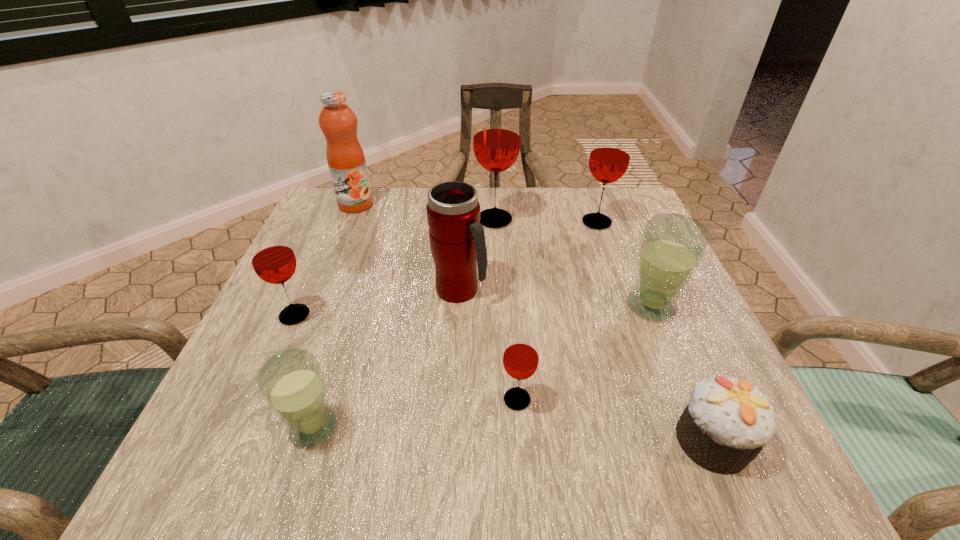
At what (x,y) coordinates should I click in order to perform the action: click on object that is at the near right corner. Please return your answer as a coordinate pair (x, y). The height and width of the screenshot is (540, 960). Looking at the image, I should click on (727, 422).

This screenshot has height=540, width=960. Find the location of `vacant region at the far edge of the desktop`. vacant region at the far edge of the desktop is located at coordinates (524, 212).

Where is `vacant space at the near edge of the desktop`? vacant space at the near edge of the desktop is located at coordinates (345, 436).

Identify the location of free location at the left edge of the desktop. (319, 294).

Identify the location of vacant space at the right edge. The height and width of the screenshot is (540, 960). (596, 260).

In the image, there is a desktop. Where is `vacant space at the far right corner`? This screenshot has width=960, height=540. vacant space at the far right corner is located at coordinates (584, 198).

Find the location of a particular element. The height and width of the screenshot is (540, 960). free space between the leftmost red glass and the smallest red glass is located at coordinates pyautogui.click(x=406, y=357).

Locate an element on the screen. empty space that is in between the tallest glass and the smallest red glass is located at coordinates (506, 309).

You are a GUI agent. You are given a task and a screenshot of the screen. Output one action in this format:
    pyautogui.click(x=<x>, y=<y>)
    Task: Click on the empty space that is in between the smallest red glass and the fifth glass from right to left
    Image resolution: width=960 pixels, height=540 pixels.
    Given the screenshot: What is the action you would take?
    pyautogui.click(x=415, y=414)

The width and height of the screenshot is (960, 540). I want to click on vacant space in between the nearer blue glass and the second tallest glass, so click(x=455, y=325).